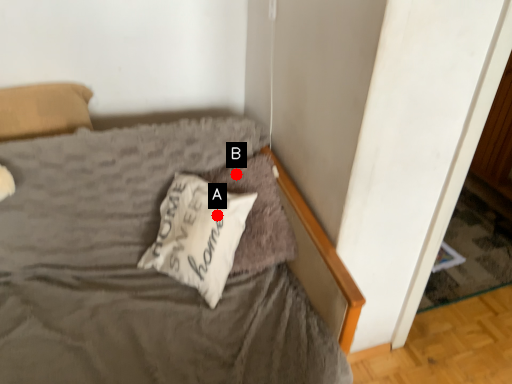
Question: Two points are circled on the image, labeled by A and B beside each circle. Which point appears closest to the camera in this image?

Choices:
 (A) A is closer
 (B) B is closer

Answer: (A)